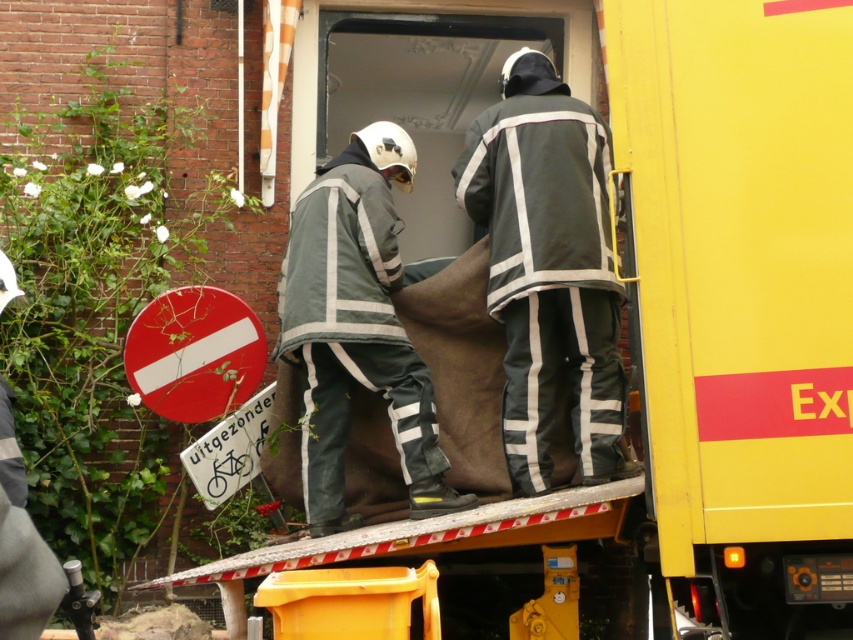
Question: Can you confirm if dark green fabric suit at center is smaller than gray fabric fireman at center?

Choices:
 (A) yes
 (B) no

Answer: (A)

Question: Among these objects, which one is farthest from the camera?

Choices:
 (A) dark green fabric suit at center
 (B) gray fabric fireman at center

Answer: (B)

Question: Is dark green fabric suit at center to the right of gray fabric fireman at center from the viewer's perspective?

Choices:
 (A) no
 (B) yes

Answer: (B)

Question: Which of the following is the closest to the observer?

Choices:
 (A) gray fabric fireman at center
 (B) dark green fabric suit at center

Answer: (B)

Question: Which of the following is the closest to the observer?

Choices:
 (A) dark green fabric suit at center
 (B) gray fabric fireman at center

Answer: (A)

Question: Can you confirm if dark green fabric suit at center is thinner than gray fabric fireman at center?

Choices:
 (A) no
 (B) yes

Answer: (B)